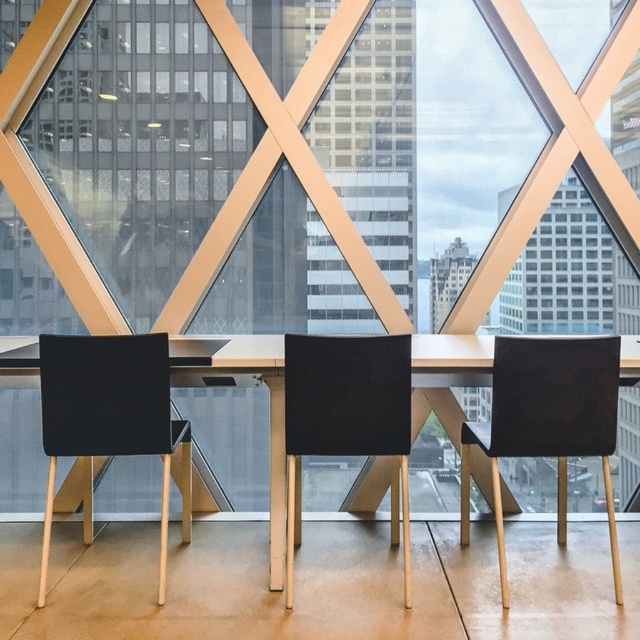
Question: Which of the following is the farthest from the observer?

Choices:
 (A) (84, 397)
 (B) (401, 340)
 (C) (620, 348)

Answer: (A)

Question: Among these objects, which one is farthest from the camera?

Choices:
 (A) black leather chair at center
 (B) matte black chair at left
 (C) black fabric chair at right

Answer: (B)

Question: Does metallic gold table at center appear over black leather chair at center?

Choices:
 (A) yes
 (B) no

Answer: (A)

Question: Where is matte black chair at left located in relation to metallic gold table at center in the image?

Choices:
 (A) above
 (B) below

Answer: (B)

Question: Among these objects, which one is nearest to the camera?

Choices:
 (A) black leather chair at center
 (B) black fabric chair at right

Answer: (A)

Question: Does black fabric chair at right lie in front of matte black chair at left?

Choices:
 (A) yes
 (B) no

Answer: (A)